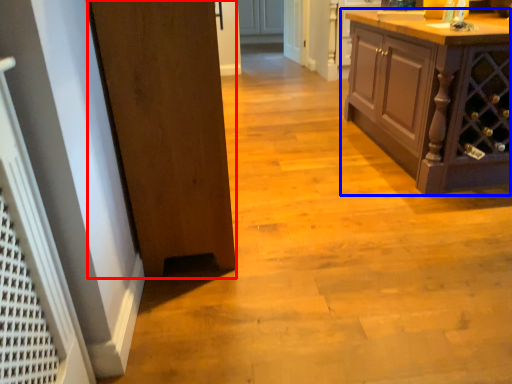
Question: Among these objects, which one is nearest to the camera, door (highlighted by a red box) or cabinetry (highlighted by a blue box)?

Choices:
 (A) door
 (B) cabinetry

Answer: (A)